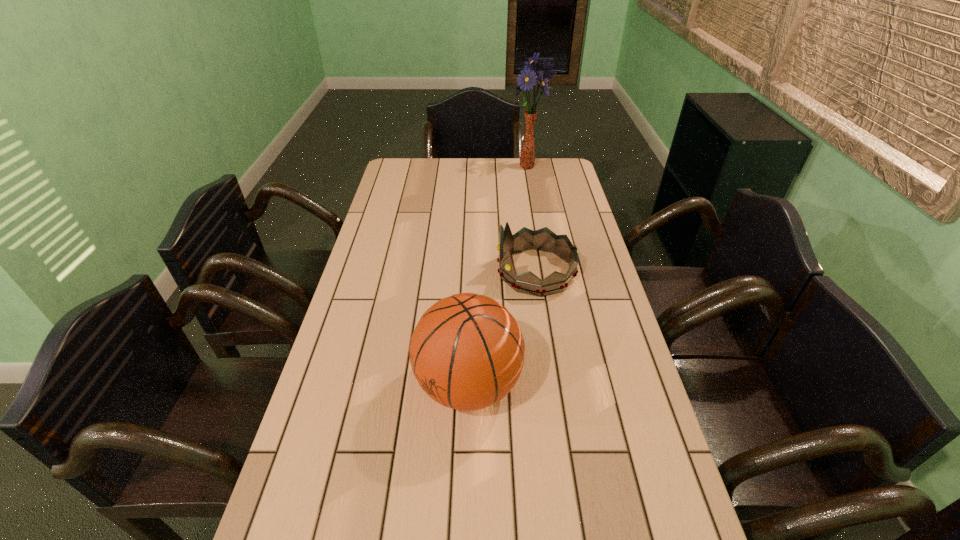
The height and width of the screenshot is (540, 960). Find the location of `vacant space located 0.380m at the front of the tiara with jewels`. vacant space located 0.380m at the front of the tiara with jewels is located at coordinates (369, 272).

Locate an element on the screen. The height and width of the screenshot is (540, 960). object that is positioned at the far edge is located at coordinates (540, 71).

Where is `flower arrangement that is positioned at the right edge`? The width and height of the screenshot is (960, 540). flower arrangement that is positioned at the right edge is located at coordinates (540, 71).

The image size is (960, 540). I want to click on tiara positioned at the right edge, so click(544, 239).

I want to click on object that is positioned at the far right corner, so click(x=540, y=71).

Where is `blank space at the far edge of the desktop`? The image size is (960, 540). blank space at the far edge of the desktop is located at coordinates (455, 170).

I want to click on free space at the left edge, so click(x=396, y=235).

Where is `vacant space at the right edge of the desktop`? vacant space at the right edge of the desktop is located at coordinates (568, 207).

Find the location of a particular element. This screenshot has width=960, height=540. free space at the far left corner is located at coordinates (391, 185).

Where is `free spot between the basketball and the flower arrangement`? free spot between the basketball and the flower arrangement is located at coordinates (497, 276).